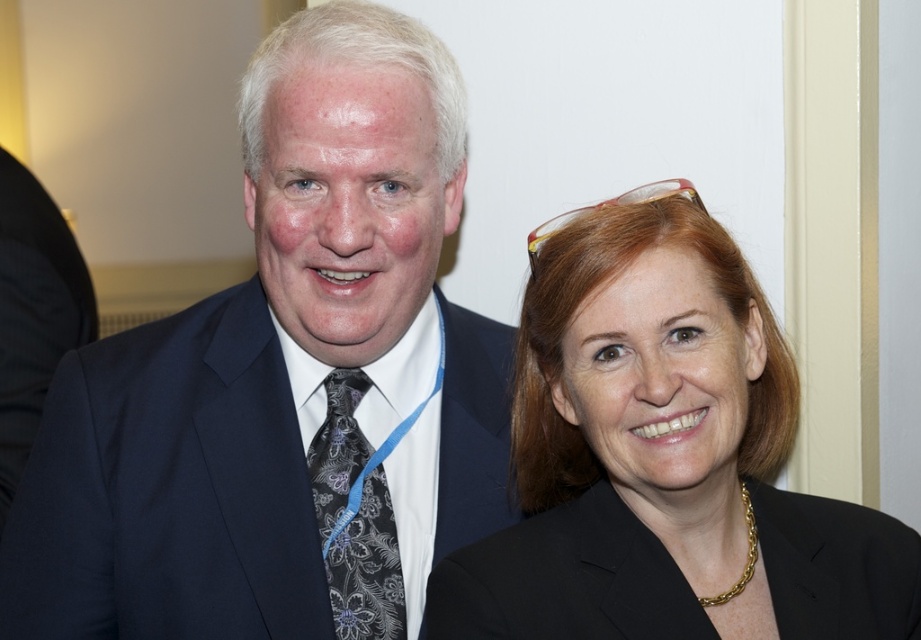
Looking at this image, which is below, matte black blazer at center or black matte blazer at lower right?

black matte blazer at lower right

Between point (581, 541) and point (646, 577), which one is positioned behind?

The point (581, 541) is more distant.

This screenshot has height=640, width=921. Find the location of `matte black blazer at center`. matte black blazer at center is located at coordinates (663, 460).

Based on the photo, is black matte blazer at lower right thinner than black floral-patterned tie at left?

Incorrect, black matte blazer at lower right's width is not less than black floral-patterned tie at left's.

Which of these two, black matte blazer at lower right or black floral-patterned tie at left, stands taller?

Standing taller between the two is black floral-patterned tie at left.

Locate an element on the screen. The image size is (921, 640). black matte blazer at lower right is located at coordinates (565, 580).

Measure the distance from dark blue suit at center to black floral-patterned tie at left.

dark blue suit at center is 5.64 inches from black floral-patterned tie at left.

Is dark blue suit at center bigger than black floral-patterned tie at left?

Correct, dark blue suit at center is larger in size than black floral-patterned tie at left.

Where is `dark blue suit at center`? dark blue suit at center is located at coordinates (286, 384).

Find the location of a particular element. Image resolution: width=921 pixels, height=640 pixels. dark blue suit at center is located at coordinates (286, 384).